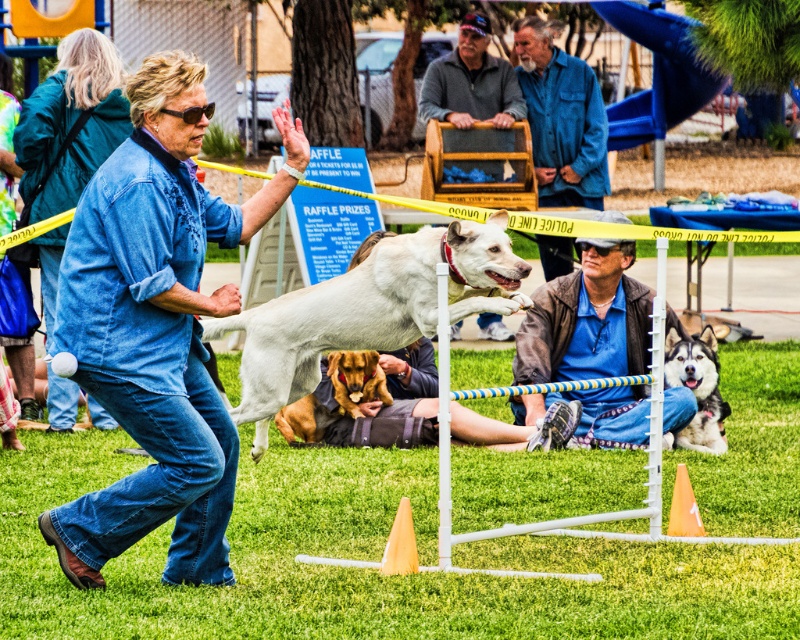
You are a photographer at the dog agility event. You need to capture a photo of both the brown fur dog at center and the silky black fur at center. Which dog should you focus on first if you want to capture them from left to right in the frame?

The brown fur dog at center should be focused on first since it is positioned on the left side of the silky black fur at center, aligning with the left to right order.

You are a photographer at the dog agility event. You need to capture a photo of both the white smooth dog at center and the silky black fur at center. Which dog should you focus on first to ensure they are in the frame?

The white smooth dog at center is larger in size compared to the silky black fur at center, so you should focus on the white smooth dog at center first to ensure it is fully in the frame.